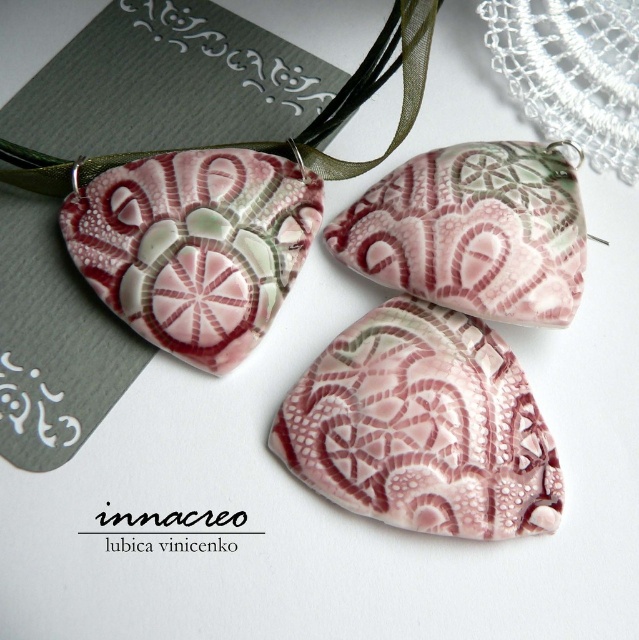
In the scene shown: You are a jeweler examining the pendant at point [422,428]. What color is the pendant at this point?

The pendant at point [422,428] is pink.

You are an appraiser evaluating the placement of the pink porcelain pendant at center. The ideal position for such jewelry is at point 0.5, 0.5. How far off is the current position from the ideal?

The pink porcelain pendant at center is positioned at point (194,246), which is 0.114 units away from the ideal position of (319,320) in the x and y coordinates respectively.